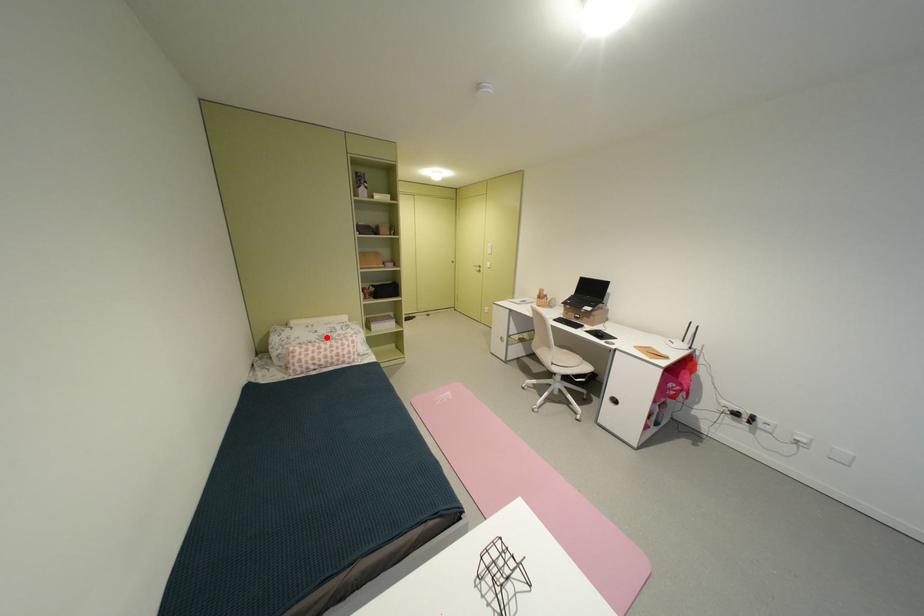
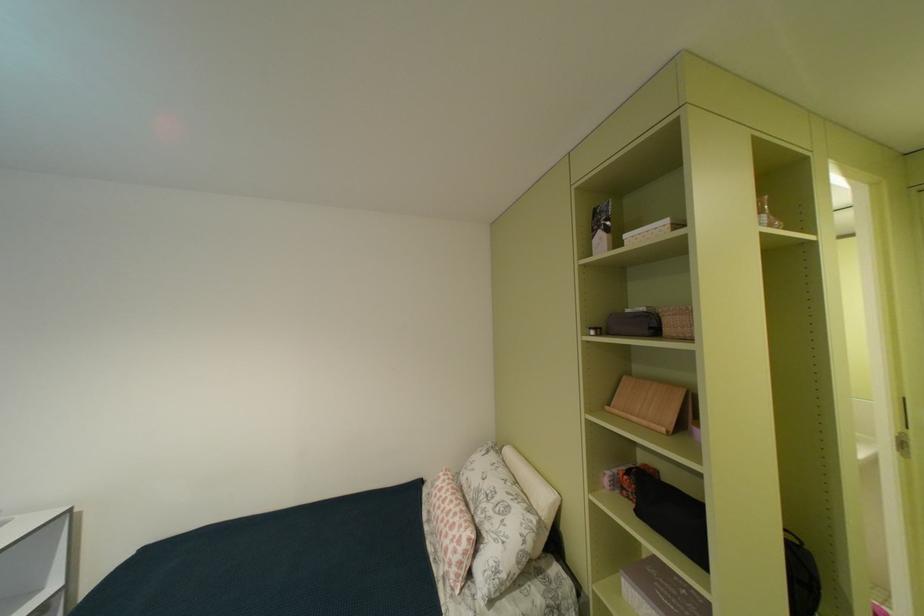
Locate, in the second image, the point that corresponds to the highlighted location in the first image.

(487, 487)